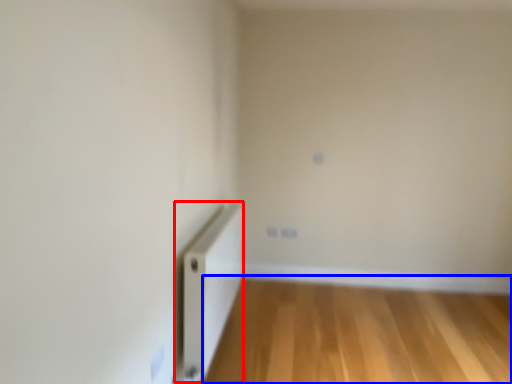
Question: Among these objects, which one is nearest to the camera, radiator (highlighted by a red box) or corridor (highlighted by a blue box)?

Choices:
 (A) radiator
 (B) corridor

Answer: (A)